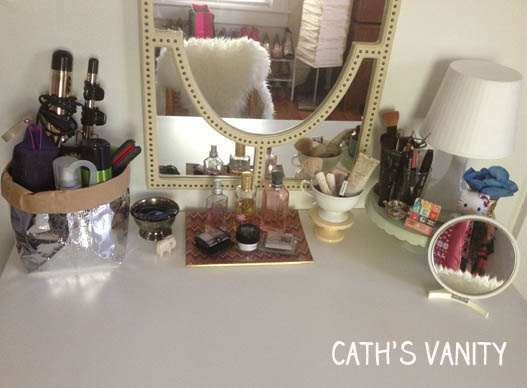
Locate an element on the screen. The width and height of the screenshot is (527, 388). cath's vanity is located at coordinates (335, 354).